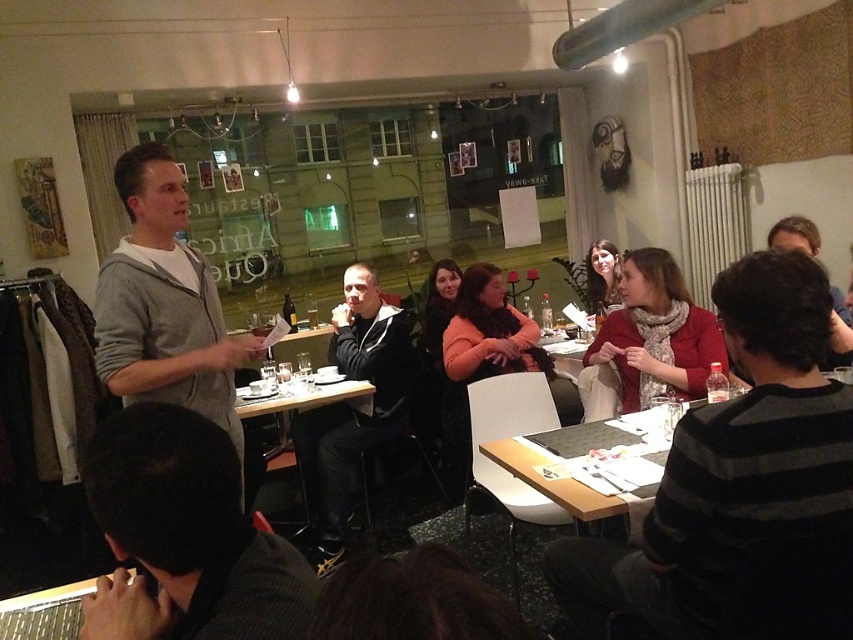
You are a photographer taking a group photo of the people in the scene. You need to ensure that both the gray hoodie at center and the matte red scarf at center are clearly visible in the photo. Which object should you focus on to ensure the other is also in focus?

The gray hoodie at center is smaller than the matte red scarf at center. To ensure both are in focus, focus on the matte red scarf at center since it is larger and will require less precise focusing, making it easier to capture both objects in the frame.